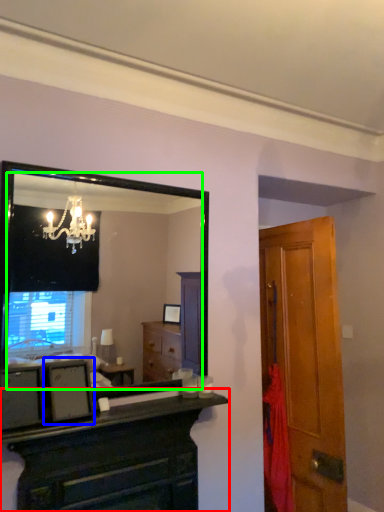
Question: Considering the real-world distances, which object is farthest from chest of drawers (highlighted by a red box)? picture frame (highlighted by a blue box) or mirror (highlighted by a green box)?

Choices:
 (A) picture frame
 (B) mirror

Answer: (B)